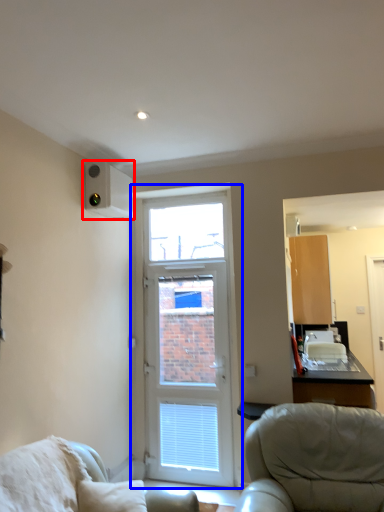
Question: Which object is closer to the camera taking this photo, air conditioning (highlighted by a red box) or door (highlighted by a blue box)?

Choices:
 (A) air conditioning
 (B) door

Answer: (A)